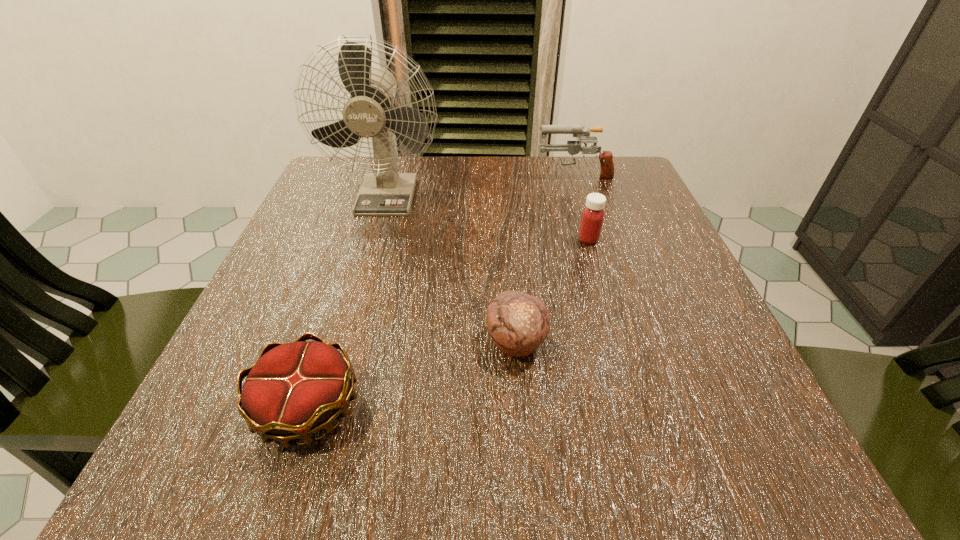
This screenshot has height=540, width=960. I want to click on empty space between the gun and the medicine, so click(x=581, y=207).

Where is `vacant space that's between the third object from left to right and the crown`? The image size is (960, 540). vacant space that's between the third object from left to right and the crown is located at coordinates point(412,375).

Where is `free spot between the fourth shortest object and the crown`? This screenshot has width=960, height=540. free spot between the fourth shortest object and the crown is located at coordinates (441, 291).

Locate an element on the screen. The height and width of the screenshot is (540, 960). free space between the muffin and the crown is located at coordinates (412, 375).

Image resolution: width=960 pixels, height=540 pixels. I want to click on free space between the third farthest object and the muffin, so click(552, 291).

Where is `empty space between the crown and the tallest object`? empty space between the crown and the tallest object is located at coordinates (348, 301).

At what (x,y) coordinates should I click in order to perform the action: click on empty space that is in between the third nearest object and the fourth shortest object. Please return your answer as a coordinate pair (x, y). Image resolution: width=960 pixels, height=540 pixels. Looking at the image, I should click on click(581, 207).

Point out which object is positioned as the nearest to the medicine. Please provide its 2D coordinates. Your answer should be formatted as a tuple, i.e. [(x, y)], where the tuple contains the x and y coordinates of a point satisfying the conditions above.

[(573, 147)]

Find the location of a particular element. the third closest object to the gun is located at coordinates (518, 322).

Locate an element on the screen. free spot that satisfies the following two spatial constraints: 1. at the barrel end of the fourth shortest object; 2. on the air flow direction of the tallest object is located at coordinates (580, 194).